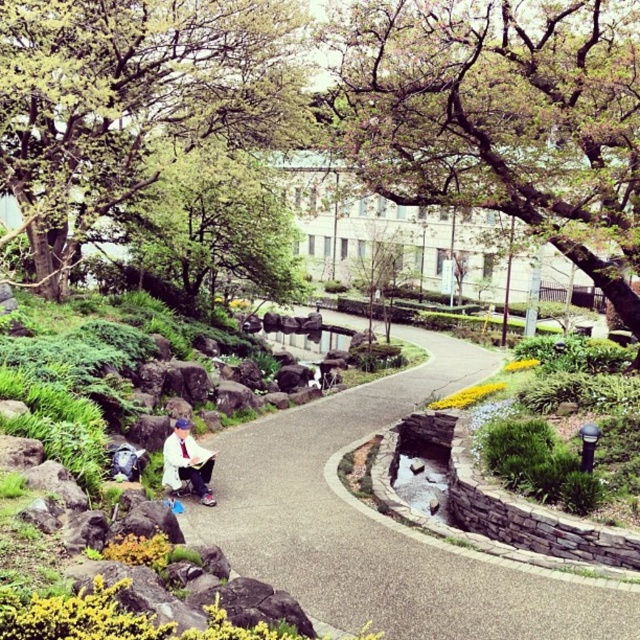
Question: Can you confirm if green leafy tree at upper center is smaller than concrete pathway at center?

Choices:
 (A) yes
 (B) no

Answer: (A)

Question: Among these objects, which one is nearest to the camera?

Choices:
 (A) green leafy tree at upper center
 (B) green leafy tree at center
 (C) green leafy tree at upper left

Answer: (A)

Question: Which point is farther to the camera?

Choices:
 (A) green leafy tree at upper left
 (B) green leafy tree at center
 (C) white fabric shirt at center
 (D) concrete pathway at center

Answer: (A)

Question: Among these objects, which one is farthest from the camera?

Choices:
 (A) concrete pathway at center
 (B) white fabric shirt at center
 (C) green leafy tree at upper left

Answer: (C)

Question: In this image, where is green leafy tree at upper left located relative to concrete pathway at center?

Choices:
 (A) left
 (B) right

Answer: (A)

Question: Can you confirm if concrete pathway at center is positioned to the right of white fabric shirt at center?

Choices:
 (A) yes
 (B) no

Answer: (A)